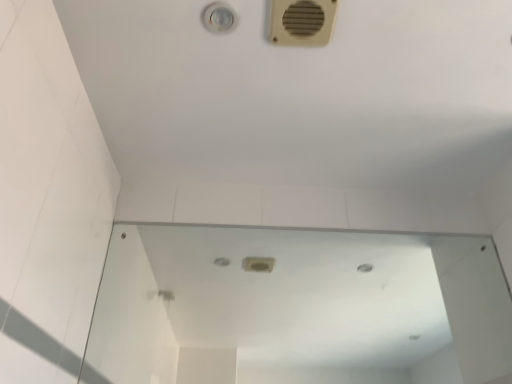
Question: Can you confirm if beige plastic air conditioning at upper right is wider than transparent glass mirror at center?

Choices:
 (A) yes
 (B) no

Answer: (A)

Question: From the image's perspective, is beige plastic air conditioning at upper right over transparent glass mirror at center?

Choices:
 (A) yes
 (B) no

Answer: (A)

Question: Considering the relative sizes of beige plastic air conditioning at upper right and transparent glass mirror at center in the image provided, is beige plastic air conditioning at upper right thinner than transparent glass mirror at center?

Choices:
 (A) no
 (B) yes

Answer: (A)

Question: Considering the relative sizes of beige plastic air conditioning at upper right and transparent glass mirror at center in the image provided, is beige plastic air conditioning at upper right shorter than transparent glass mirror at center?

Choices:
 (A) no
 (B) yes

Answer: (B)

Question: Is beige plastic air conditioning at upper right positioned before transparent glass mirror at center?

Choices:
 (A) yes
 (B) no

Answer: (A)

Question: Is beige plastic air conditioning at upper right oriented away from transparent glass mirror at center?

Choices:
 (A) no
 (B) yes

Answer: (A)

Question: Considering the relative sizes of transparent glass mirror at center and beige plastic air conditioning at upper right in the image provided, is transparent glass mirror at center bigger than beige plastic air conditioning at upper right?

Choices:
 (A) yes
 (B) no

Answer: (A)

Question: Is beige plastic air conditioning at upper right at the back of transparent glass mirror at center?

Choices:
 (A) no
 (B) yes

Answer: (A)

Question: Considering the relative positions of transparent glass mirror at center and beige plastic air conditioning at upper right in the image provided, is transparent glass mirror at center in front of beige plastic air conditioning at upper right?

Choices:
 (A) no
 (B) yes

Answer: (A)

Question: Is transparent glass mirror at center not close to beige plastic air conditioning at upper right?

Choices:
 (A) yes
 (B) no

Answer: (A)

Question: Does transparent glass mirror at center come behind beige plastic air conditioning at upper right?

Choices:
 (A) yes
 (B) no

Answer: (A)

Question: Does transparent glass mirror at center turn towards beige plastic air conditioning at upper right?

Choices:
 (A) no
 (B) yes

Answer: (B)

Question: Considering their positions, is transparent glass mirror at center located in front of or behind beige plastic air conditioning at upper right?

Choices:
 (A) behind
 (B) front

Answer: (A)